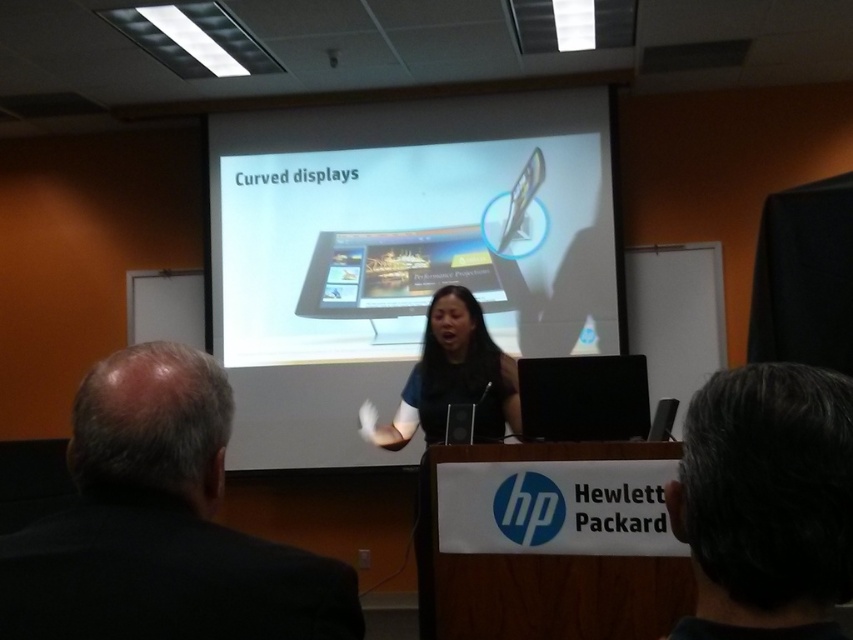
Can you confirm if black fabric shirt at center is thinner than matte black laptop at center?

In fact, black fabric shirt at center might be wider than matte black laptop at center.

Based on the photo, can you confirm if black fabric shirt at center is positioned to the left of matte black laptop at center?

Incorrect, black fabric shirt at center is not on the left side of matte black laptop at center.

Which is behind, point (433, 305) or point (445, 424)?

The point (433, 305) is more distant.

You are a GUI agent. You are given a task and a screenshot of the screen. Output one action in this format:
    pyautogui.click(x=<x>, y=<y>)
    Task: Click on the black fabric shirt at center
    The image size is (853, 640).
    Given the screenshot: What is the action you would take?
    pyautogui.click(x=451, y=378)

Does gray hair at upper right have a greater height compared to black fabric shirt at center?

Incorrect, gray hair at upper right's height is not larger of black fabric shirt at center's.

Locate an element on the screen. gray hair at upper right is located at coordinates (766, 502).

In order to click on gray hair at upper right in this screenshot , I will do `click(766, 502)`.

Is white glossy projector screen at center below black fabric shirt at center?

No.

Which is in front, point (399, 266) or point (496, 438)?

Point (496, 438) is in front.

The image size is (853, 640). What are the coordinates of `white glossy projector screen at center` in the screenshot? It's located at (410, 227).